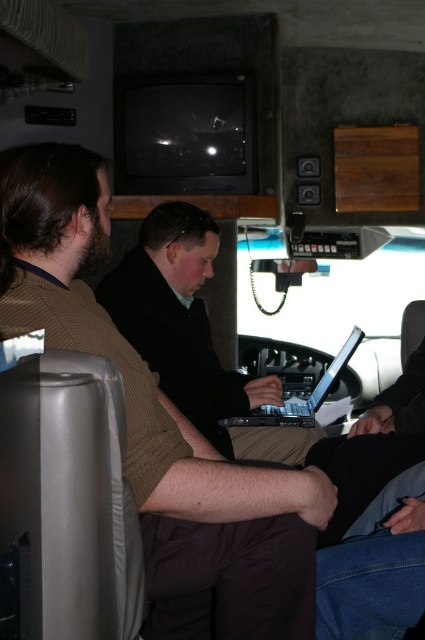
Question: Is black matte laptop at center positioned behind silver metallic laptop at center?

Choices:
 (A) no
 (B) yes

Answer: (A)

Question: Can you confirm if black matte laptop at center is smaller than silver metallic laptop at center?

Choices:
 (A) yes
 (B) no

Answer: (B)

Question: Does black matte laptop at center have a larger size compared to silver metallic laptop at center?

Choices:
 (A) no
 (B) yes

Answer: (B)

Question: Which of the following is the closest to the observer?

Choices:
 (A) (350, 346)
 (B) (184, 292)

Answer: (B)